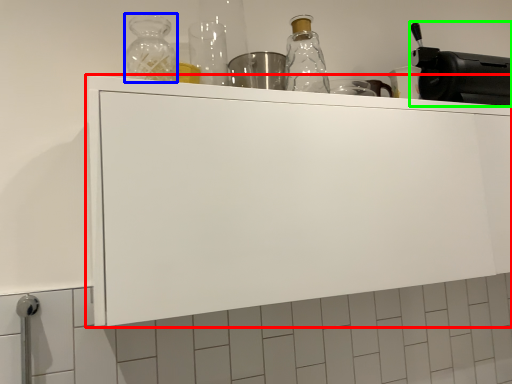
Question: Estimate the real-world distances between objects in this image. Which object is closer to cabinetry (highlighted by a red box), bottle (highlighted by a blue box) or appliance (highlighted by a green box)?

Choices:
 (A) bottle
 (B) appliance

Answer: (A)